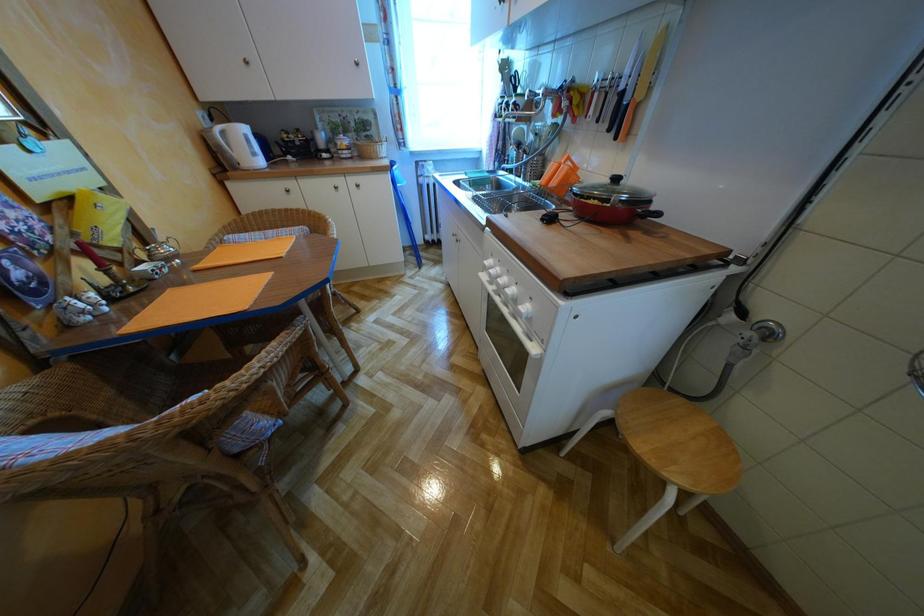
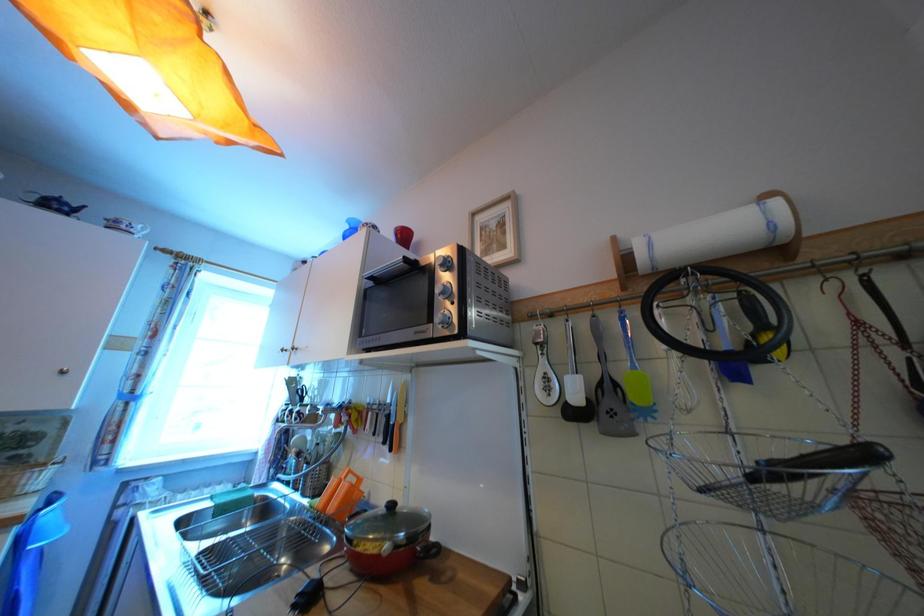
The first image is from the beginning of the video and the second image is from the end. How did the camera likely rotate when shooting the video?

The rotation direction of the camera is right-up.